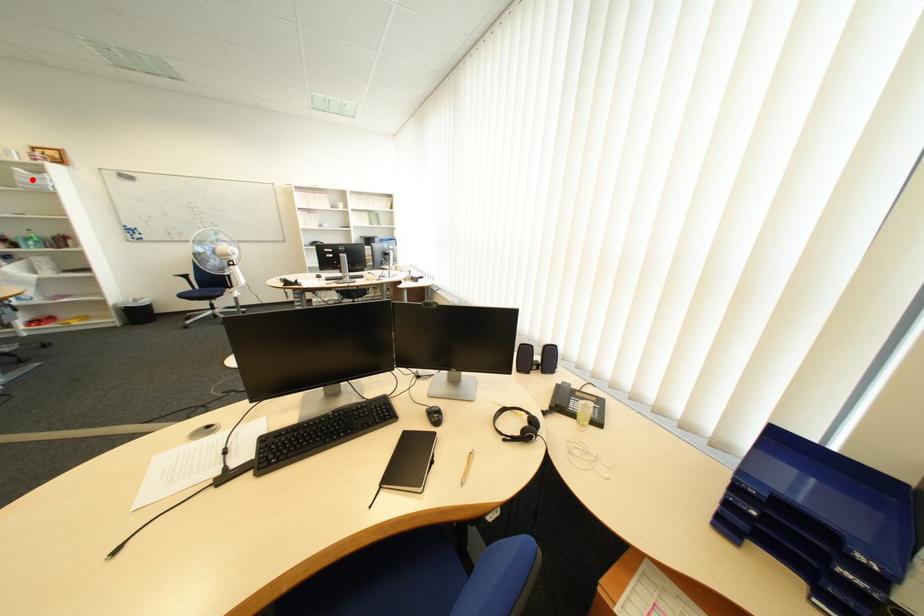
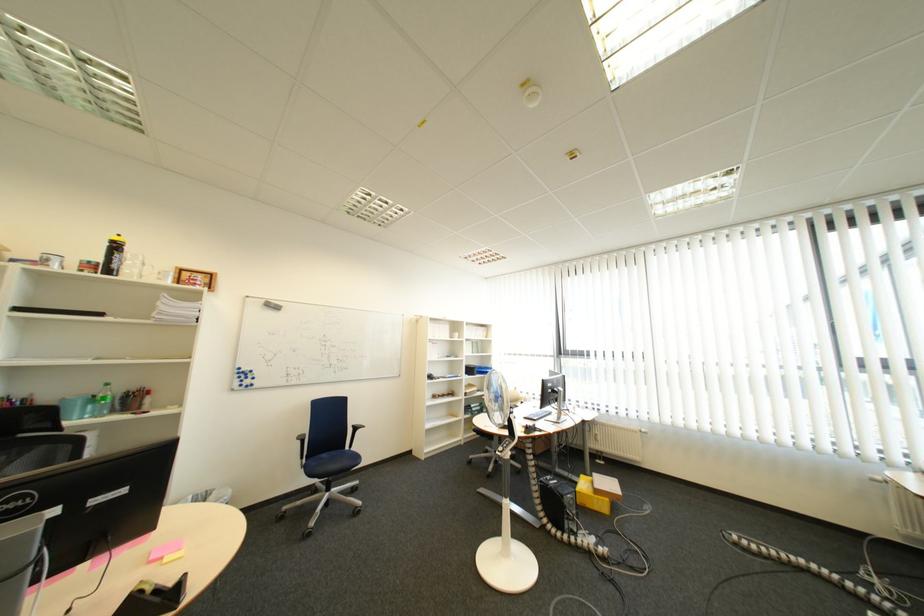
Question: I am providing you with two images of the same scene from different viewpoints. Image1 has a red point marked. In image2, the corresponding 3D location appears at what relative position? Reply with the corresponding letter.

Choices:
 (A) Closer
 (B) Farther

Answer: (A)